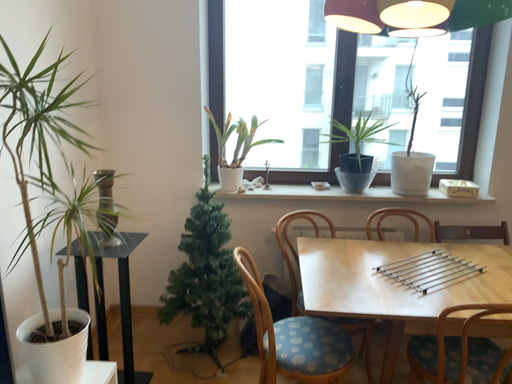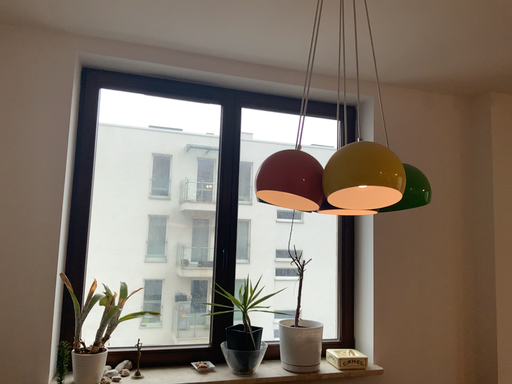
Question: How did the camera likely rotate when shooting the video?

Choices:
 (A) rotated upward
 (B) rotated downward

Answer: (A)